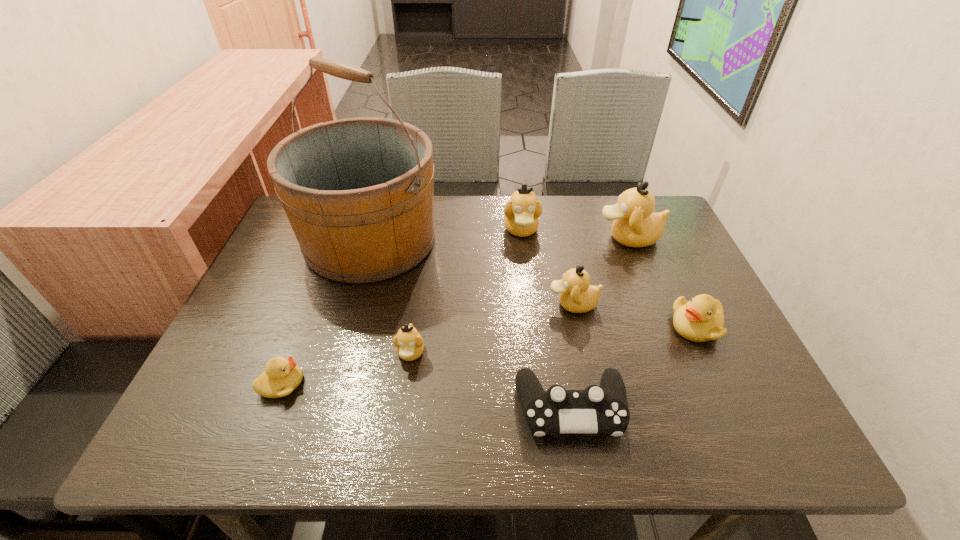
Identify the location of free space between the nearest tan duckling and the bucket. The image size is (960, 540). (391, 296).

Locate an element on the screen. The height and width of the screenshot is (540, 960). empty space that is in between the fourth shortest duckling and the smallest tan duckling is located at coordinates (492, 328).

Find the location of a particular element. The height and width of the screenshot is (540, 960). vacant space in between the second biggest tan duckling and the black control is located at coordinates coord(546,319).

This screenshot has width=960, height=540. I want to click on empty location between the fourth tallest object and the leftmost duckling, so click(x=427, y=344).

Image resolution: width=960 pixels, height=540 pixels. I want to click on blank region between the fifth shortest duckling and the right yellow duckling, so click(609, 278).

You are a GUI agent. You are given a task and a screenshot of the screen. Output one action in this format:
    pyautogui.click(x=<x>, y=<y>)
    Task: Click on the free spot between the third tallest duckling and the fifth shortest duckling
    This screenshot has width=960, height=540.
    Given the screenshot: What is the action you would take?
    pyautogui.click(x=547, y=267)

The width and height of the screenshot is (960, 540). What are the coordinates of `unoccupied area between the tallest duckling and the tallest object` in the screenshot? It's located at (499, 239).

This screenshot has width=960, height=540. What are the coordinates of `the second closest object relative to the tallest object` in the screenshot? It's located at (521, 212).

Where is `the closest object to the nearest tan duckling`? This screenshot has width=960, height=540. the closest object to the nearest tan duckling is located at coordinates (358, 192).

Identify which duckling is the third closest to the fifth shortest duckling. Please provide its 2D coordinates. Your answer should be formatted as a tuple, i.e. [(x, y)], where the tuple contains the x and y coordinates of a point satisfying the conditions above.

[(701, 319)]